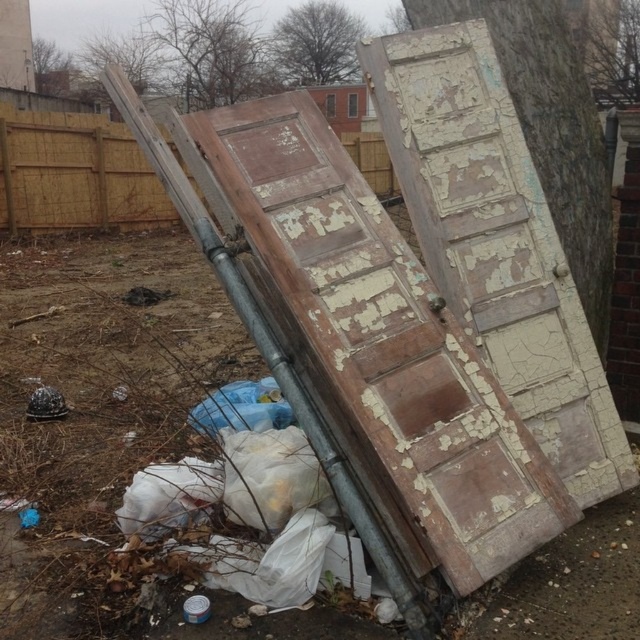
Question: Does peeling paint wood door at center lie in front of wooden fence at upper left?

Choices:
 (A) yes
 (B) no

Answer: (A)

Question: Which point is farther to the camera?

Choices:
 (A) peeling paint wood door at center
 (B) wooden fence at upper left

Answer: (B)

Question: Is peeling paint wood door at center to the left of wooden fence at upper left from the viewer's perspective?

Choices:
 (A) no
 (B) yes

Answer: (A)

Question: Does peeling paint wood door at center lie in front of wooden fence at upper left?

Choices:
 (A) yes
 (B) no

Answer: (A)